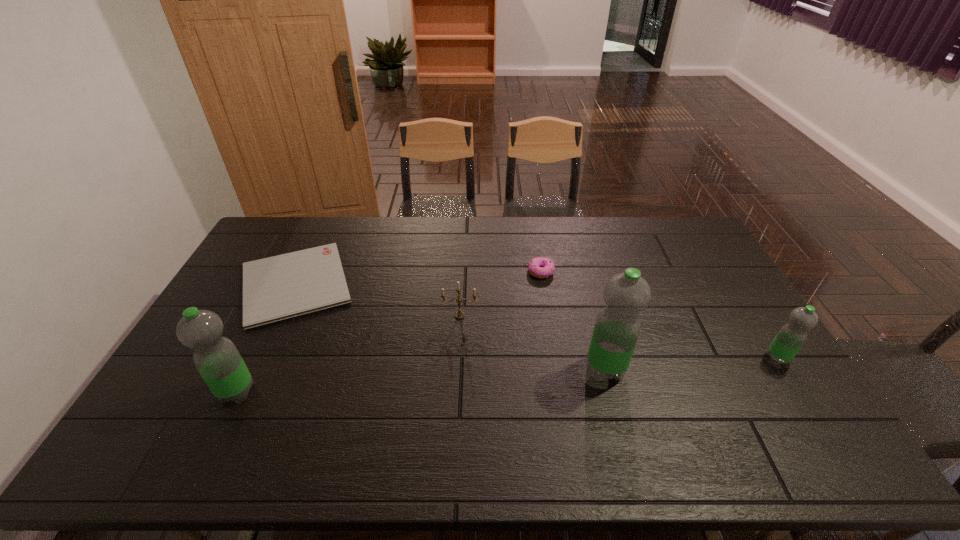
The width and height of the screenshot is (960, 540). In order to click on object that is at the right edge in this screenshot , I will do `click(790, 338)`.

This screenshot has width=960, height=540. I want to click on object at the far left corner, so click(280, 287).

At what (x,y) coordinates should I click in order to perform the action: click on object located at the near left corner. Please return your answer as a coordinate pair (x, y). Image resolution: width=960 pixels, height=540 pixels. Looking at the image, I should click on (217, 359).

Find the location of a particular element. The image size is (960, 540). vacant point at the far edge is located at coordinates (590, 230).

You are a GUI agent. You are given a task and a screenshot of the screen. Output one action in this format:
    pyautogui.click(x=<x>, y=<y>)
    Task: Click on the free location at the near edge of the desktop
    
    Given the screenshot: What is the action you would take?
    pyautogui.click(x=398, y=402)

The image size is (960, 540). In order to click on vacant space at the left edge in this screenshot , I will do 237,309.

Image resolution: width=960 pixels, height=540 pixels. Identify the location of vacant space at the right edge of the desktop. (706, 298).

Identify the location of free space at the far left corner of the desktop. This screenshot has height=540, width=960. (303, 217).

Where is `free space between the shortest object and the second shortest object`? free space between the shortest object and the second shortest object is located at coordinates (419, 278).

Where is `free space between the fourth object from left to right and the leftmost water bottle`? The height and width of the screenshot is (540, 960). free space between the fourth object from left to right and the leftmost water bottle is located at coordinates pos(389,332).